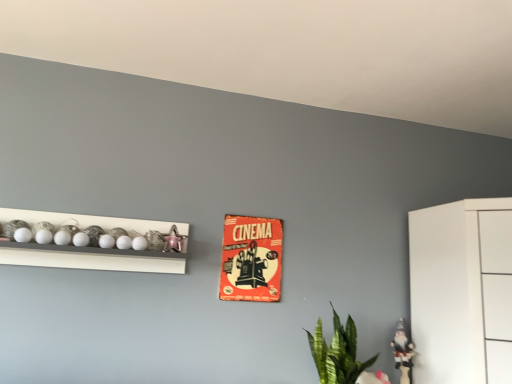
You are a GUI agent. You are given a task and a screenshot of the screen. Output one action in this format:
    pyautogui.click(x=<x>, y=<y>)
    Task: Click on the red cardboard cinema poster at center
    Image resolution: width=512 pixels, height=384 pixels.
    Given the screenshot: What is the action you would take?
    pyautogui.click(x=251, y=259)

This screenshot has width=512, height=384. I want to click on metallic pink star at upper left, the first toy from the left, so click(x=173, y=240).

How far apart are red cardboard cinema poster at center and green leafy plant at lower right?

red cardboard cinema poster at center and green leafy plant at lower right are 16.61 inches apart from each other.

Can you confirm if red cardboard cinema poster at center is taller than green leafy plant at lower right?

Yes.

Would you say red cardboard cinema poster at center is to the left or to the right of green leafy plant at lower right in the picture?

In the image, red cardboard cinema poster at center appears on the left side of green leafy plant at lower right.

From the image's perspective, is red cardboard cinema poster at center positioned above or below green leafy plant at lower right?

red cardboard cinema poster at center is above green leafy plant at lower right.

Is green leafy plant at lower right looking in the opposite direction of red cardboard cinema poster at center?

That's not correct — green leafy plant at lower right is not looking away from red cardboard cinema poster at center.

Looking at their sizes, would you say green leafy plant at lower right is wider or thinner than red cardboard cinema poster at center?

Clearly, green leafy plant at lower right has more width compared to red cardboard cinema poster at center.

From a real-world perspective, between green leafy plant at lower right and red cardboard cinema poster at center, who is vertically lower?

green leafy plant at lower right, from a real-world perspective.

Consider the image. How far apart are green leafy plant at lower right and red cardboard cinema poster at center?

green leafy plant at lower right is 16.61 inches away from red cardboard cinema poster at center.

Is white glossy gnome at lower right, which is counted as the 2th toy, starting from the left, aimed at white glossy shelf at upper left?

No.

Does white glossy gnome at lower right, positioned as the second toy in top-to-bottom order, have a greater height compared to white glossy shelf at upper left?

Indeed, white glossy gnome at lower right, positioned as the second toy in top-to-bottom order, has a greater height compared to white glossy shelf at upper left.

In terms of width, does white glossy gnome at lower right, positioned as the second toy in top-to-bottom order, look wider or thinner when compared to white glossy shelf at upper left?

Considering their sizes, white glossy gnome at lower right, positioned as the second toy in top-to-bottom order, looks slimmer than white glossy shelf at upper left.

Locate an element on the screen. the 2nd toy to the right of the white glossy shelf at upper left, starting your count from the anchor is located at coordinates (403, 352).

Is white glossy shelf at upper left directly adjacent to metallic pink star at upper left, placed as the 2th toy when sorted from right to left?

No, white glossy shelf at upper left is not making contact with metallic pink star at upper left, placed as the 2th toy when sorted from right to left.

How far apart are white glossy shelf at upper left and metallic pink star at upper left, marked as the 2th toy in a bottom-to-top arrangement?

white glossy shelf at upper left is 10.26 inches away from metallic pink star at upper left, marked as the 2th toy in a bottom-to-top arrangement.

Between white glossy shelf at upper left and metallic pink star at upper left, acting as the first toy starting from the front, which one is positioned behind?

metallic pink star at upper left, acting as the first toy starting from the front, is further away from the camera.

Is white glossy shelf at upper left turned away from metallic pink star at upper left, the first toy from the left?

Yes, white glossy shelf at upper left is facing away from metallic pink star at upper left, the first toy from the left.

Looking at the image, does green leafy plant at lower right seem bigger or smaller compared to metallic pink star at upper left, marked as the 2th toy in a bottom-to-top arrangement?

In the image, green leafy plant at lower right appears to be larger than metallic pink star at upper left, marked as the 2th toy in a bottom-to-top arrangement.

What's the angular difference between green leafy plant at lower right and metallic pink star at upper left, marked as the 1th toy in a top-to-bottom arrangement,'s facing directions?

The angular difference between green leafy plant at lower right and metallic pink star at upper left, marked as the 1th toy in a top-to-bottom arrangement, is 4.1 degrees.

Who is shorter, green leafy plant at lower right or metallic pink star at upper left, the 2th toy in the back-to-front sequence?

metallic pink star at upper left, the 2th toy in the back-to-front sequence, is shorter.

Which point is more distant from viewer, (325, 344) or (167, 235)?

The point (325, 344) is farther from the camera.

Looking at this image, from the image's perspective, between red cardboard cinema poster at center and metallic pink star at upper left, the 2th toy in the back-to-front sequence, who is located below?

From the image's view, red cardboard cinema poster at center is below.

Does red cardboard cinema poster at center have a lesser height compared to metallic pink star at upper left, the first toy from the left?

Incorrect, the height of red cardboard cinema poster at center does not fall short of that of metallic pink star at upper left, the first toy from the left.

From a real-world perspective, is red cardboard cinema poster at center beneath metallic pink star at upper left, marked as the 1th toy in a top-to-bottom arrangement?

Yes, from a real-world perspective, red cardboard cinema poster at center is beneath metallic pink star at upper left, marked as the 1th toy in a top-to-bottom arrangement.

Does red cardboard cinema poster at center have a lesser width compared to metallic pink star at upper left, acting as the first toy starting from the front?

Yes.

From the image's perspective, which is above, green leafy plant at lower right or white glossy shelf at upper left?

white glossy shelf at upper left appears higher in the image.

Is point (350, 318) positioned after point (35, 256)?

Yes, point (350, 318) is behind point (35, 256).

Is green leafy plant at lower right positioned far away from white glossy shelf at upper left?

Actually, green leafy plant at lower right and white glossy shelf at upper left are a little close together.

Does green leafy plant at lower right have a larger size compared to white glossy shelf at upper left?

No.

You are a GUI agent. You are given a task and a screenshot of the screen. Output one action in this format:
    pyautogui.click(x=<x>, y=<y>)
    Task: Click on the houseplant below the red cardboard cinema poster at center (from a real-world perspective)
    The width and height of the screenshot is (512, 384).
    Given the screenshot: What is the action you would take?
    click(x=337, y=352)

You are a GUI agent. You are given a task and a screenshot of the screen. Output one action in this format:
    pyautogui.click(x=<x>, y=<y>)
    Task: Click on the houseplant in front of the red cardboard cinema poster at center
    Image resolution: width=512 pixels, height=384 pixels.
    Given the screenshot: What is the action you would take?
    pyautogui.click(x=337, y=352)

Estimate the real-world distances between objects in this image. Which object is closer to white glossy shelf at upper left, red cardboard cinema poster at center or metallic pink star at upper left, the first toy from the left?

Based on the image, metallic pink star at upper left, the first toy from the left, appears to be nearer to white glossy shelf at upper left.

Considering their positions, is metallic pink star at upper left, acting as the first toy starting from the front, positioned further to white glossy gnome at lower right, arranged as the second toy when viewed from the front, than green leafy plant at lower right?

The object further to white glossy gnome at lower right, arranged as the second toy when viewed from the front, is metallic pink star at upper left, acting as the first toy starting from the front.

Looking at the image, which one is located closer to white glossy shelf at upper left, metallic pink star at upper left, marked as the 2th toy in a bottom-to-top arrangement, or red cardboard cinema poster at center?

Among the two, metallic pink star at upper left, marked as the 2th toy in a bottom-to-top arrangement, is located nearer to white glossy shelf at upper left.

Which object lies nearer to the anchor point green leafy plant at lower right, red cardboard cinema poster at center or white glossy gnome at lower right, which ranks as the first toy in bottom-to-top order?

The object closer to green leafy plant at lower right is white glossy gnome at lower right, which ranks as the first toy in bottom-to-top order.

When comparing their distances from red cardboard cinema poster at center, does white glossy gnome at lower right, positioned as the second toy in top-to-bottom order, or white glossy shelf at upper left seem closer?

white glossy shelf at upper left lies closer to red cardboard cinema poster at center than the other object.

From the image, which object appears to be farther from metallic pink star at upper left, the 2th toy in the back-to-front sequence, green leafy plant at lower right or red cardboard cinema poster at center?

Among the two, green leafy plant at lower right is located further to metallic pink star at upper left, the 2th toy in the back-to-front sequence.

Looking at the image, which one is located closer to metallic pink star at upper left, the 2th toy in the back-to-front sequence, red cardboard cinema poster at center or green leafy plant at lower right?

Based on the image, red cardboard cinema poster at center appears to be nearer to metallic pink star at upper left, the 2th toy in the back-to-front sequence.

Estimate the real-world distances between objects in this image. Which object is further from red cardboard cinema poster at center, green leafy plant at lower right or white glossy shelf at upper left?

white glossy shelf at upper left lies further to red cardboard cinema poster at center than the other object.

Find the location of a particular element. toy between white glossy shelf at upper left and white glossy gnome at lower right, which is counted as the 2th toy, starting from the left, from left to right is located at coordinates (173, 240).

Find the location of a particular element. The image size is (512, 384). toy between white glossy shelf at upper left and green leafy plant at lower right is located at coordinates click(173, 240).

Where is `postcard located between white glossy shelf at upper left and green leafy plant at lower right in the left-right direction`? This screenshot has height=384, width=512. postcard located between white glossy shelf at upper left and green leafy plant at lower right in the left-right direction is located at coordinates (251, 259).

Find the location of `houseplant between white glossy shelf at upper left and white glossy gnome at lower right, arranged as the second toy when viewed from the front, in the horizontal direction`. houseplant between white glossy shelf at upper left and white glossy gnome at lower right, arranged as the second toy when viewed from the front, in the horizontal direction is located at coordinates (337, 352).